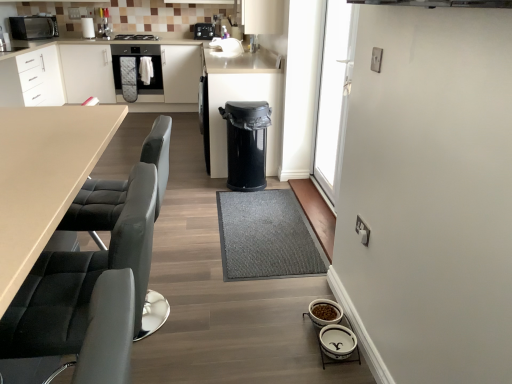
Image resolution: width=512 pixels, height=384 pixels. I want to click on free space behind black leather swivel chair at left, so click(x=183, y=260).